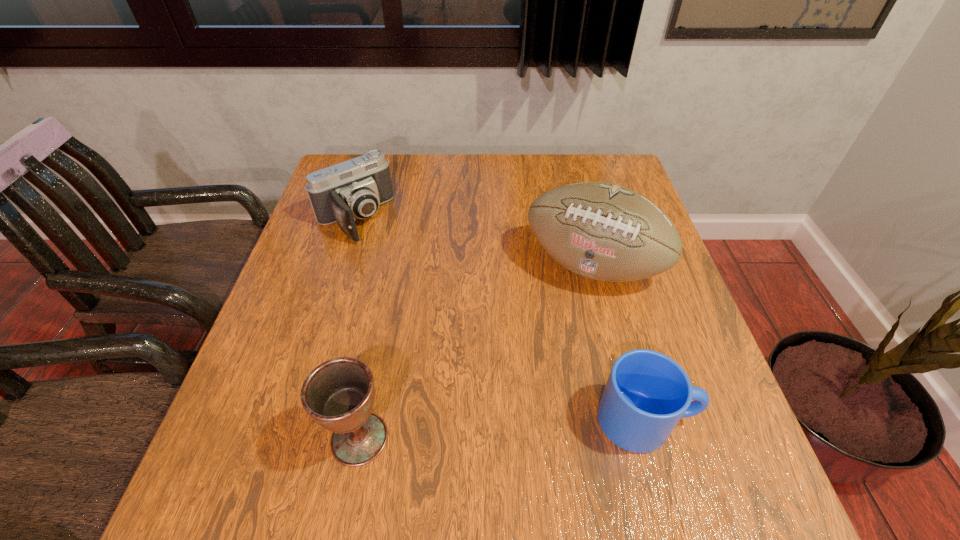
This screenshot has height=540, width=960. I want to click on vacant space positioned 0.320m at the front of the camera with an open lens cover, so click(x=435, y=318).

What are the coordinates of `blank space located 0.140m at the front of the camera with an open lens cover` in the screenshot? It's located at (396, 271).

Locate an element on the screen. This screenshot has width=960, height=540. object that is at the far edge is located at coordinates (354, 189).

Where is `chalice that is at the near edge`? chalice that is at the near edge is located at coordinates pyautogui.click(x=339, y=394).

Where is `mug situated at the near edge`? This screenshot has width=960, height=540. mug situated at the near edge is located at coordinates (647, 393).

Locate an element on the screen. object at the left edge is located at coordinates (354, 189).

Locate an element on the screen. mug situated at the right edge is located at coordinates (647, 393).

Find the location of a particular element. football (American) at the right edge is located at coordinates (605, 232).

Find the location of `object that is at the far left corner`. object that is at the far left corner is located at coordinates (354, 189).

Identify the location of object that is at the near right corner. The width and height of the screenshot is (960, 540). (647, 393).